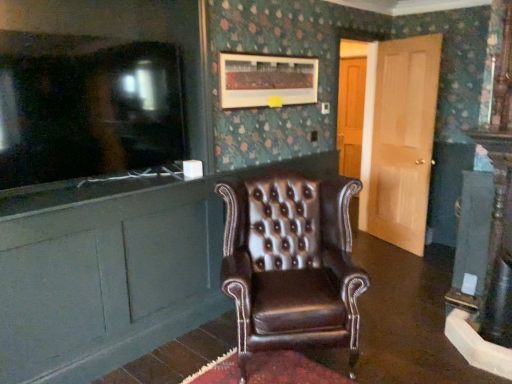
The image size is (512, 384). I want to click on vacant space underneath matte black television at left (from a real-world perspective), so click(x=128, y=187).